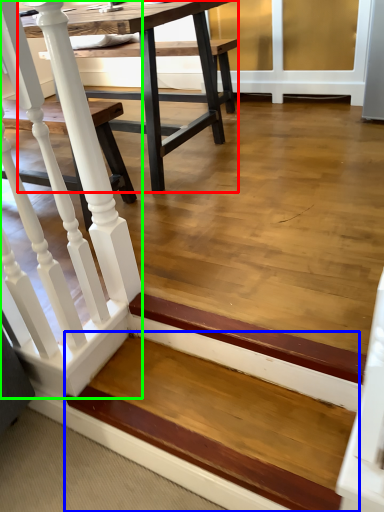
Question: Which object is positioned farthest from table (highlighted by a red box)? Select from stairwell (highlighted by a blue box) and rail (highlighted by a green box).

Choices:
 (A) stairwell
 (B) rail

Answer: (A)